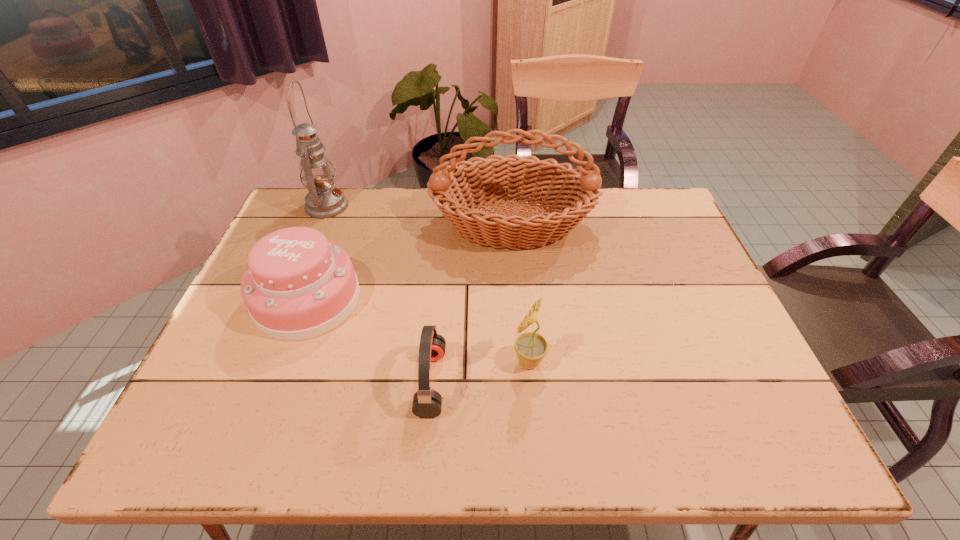
Where is `blank region between the basket and the earphone`? The width and height of the screenshot is (960, 540). blank region between the basket and the earphone is located at coordinates (471, 303).

This screenshot has height=540, width=960. Find the location of `free space between the second tallest object and the oil lamp`. free space between the second tallest object and the oil lamp is located at coordinates (420, 215).

You are a GUI agent. You are given a task and a screenshot of the screen. Output one action in this format:
    pyautogui.click(x=<x>, y=<y>)
    Task: Click on the object that can be found as the third closest to the third nearest object
    The width and height of the screenshot is (960, 540).
    Given the screenshot: What is the action you would take?
    pyautogui.click(x=324, y=200)

Identify which object is the third nearest to the shortest object. Please provide its 2D coordinates. Your answer should be formatted as a tuple, i.e. [(x, y)], where the tuple contains the x and y coordinates of a point satisfying the conditions above.

[(571, 194)]